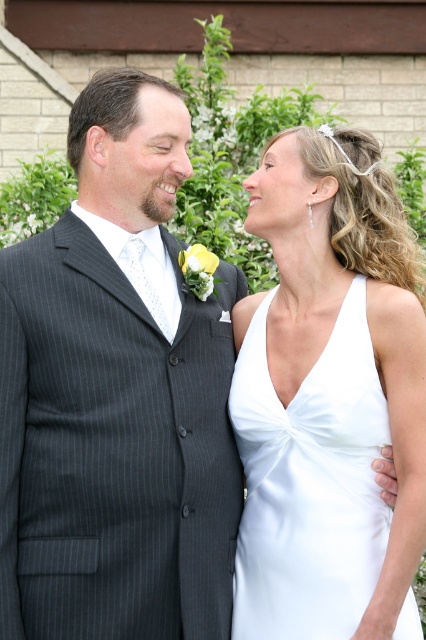
Question: Does dark gray pinstripe suit at center have a lesser width compared to white satin dress at center?

Choices:
 (A) yes
 (B) no

Answer: (B)

Question: Among these objects, which one is farthest from the camera?

Choices:
 (A) dark gray pinstripe suit at center
 (B) white satin dress at center

Answer: (B)

Question: Considering the relative positions of dark gray pinstripe suit at center and white satin dress at center in the image provided, where is dark gray pinstripe suit at center located with respect to white satin dress at center?

Choices:
 (A) right
 (B) left

Answer: (B)

Question: Is dark gray pinstripe suit at center thinner than white satin dress at center?

Choices:
 (A) no
 (B) yes

Answer: (A)

Question: Among these objects, which one is farthest from the camera?

Choices:
 (A) white satin dress at center
 (B) dark gray pinstripe suit at center

Answer: (A)